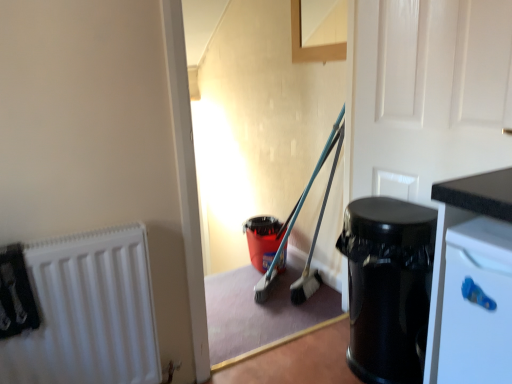
Locate an element on the screen. Image resolution: width=512 pixels, height=384 pixels. white matte radiator at left is located at coordinates (88, 313).

This screenshot has height=384, width=512. What are the coordinates of `black glossy trash can at right` in the screenshot? It's located at (388, 287).

Considering the relative sizes of white glossy door at upper right and white matte radiator at left in the image provided, is white glossy door at upper right thinner than white matte radiator at left?

Indeed, white glossy door at upper right has a lesser width compared to white matte radiator at left.

Where is `door on the right of white matte radiator at left`? door on the right of white matte radiator at left is located at coordinates (426, 93).

Which object is further away from the camera taking this photo, white glossy door at upper right or white matte radiator at left?

white matte radiator at left is more distant.

Is white matte radiator at left taller than black glossy trash can at right?

Incorrect, the height of white matte radiator at left is not larger of that of black glossy trash can at right.

Looking at this image, what's the angular difference between white matte radiator at left and black glossy trash can at right's facing directions?

There is a 87.1-degree angle between the facing directions of white matte radiator at left and black glossy trash can at right.

Does white matte radiator at left have a greater width compared to black glossy trash can at right?

In fact, white matte radiator at left might be narrower than black glossy trash can at right.

Considering the positions of objects white matte radiator at left and black glossy trash can at right in the image provided, who is behind, white matte radiator at left or black glossy trash can at right?

black glossy trash can at right is behind.

Which of these two, white matte radiator at left or white glossy door at upper right, is wider?

white matte radiator at left is wider.

The height and width of the screenshot is (384, 512). Identify the location of door on the right of white matte radiator at left. point(426,93).

From the image's perspective, which object appears higher, white matte radiator at left or white glossy door at upper right?

From the image's view, white glossy door at upper right is above.

How different are the orientations of black glossy trash can at right and white matte radiator at left in degrees?

87.1 degrees separate the facing orientations of black glossy trash can at right and white matte radiator at left.

Considering the sizes of objects black glossy trash can at right and white matte radiator at left in the image provided, who is thinner, black glossy trash can at right or white matte radiator at left?

white matte radiator at left.

How much distance is there between black glossy trash can at right and white matte radiator at left?

34.66 inches.

From the picture: Can you confirm if black glossy trash can at right is smaller than white matte radiator at left?

No.

Can you tell me how much white glossy door at upper right and black glossy trash can at right differ in facing direction?

The angular difference between white glossy door at upper right and black glossy trash can at right is 0.000616 degrees.

Does white glossy door at upper right turn towards black glossy trash can at right?

Yes, white glossy door at upper right is oriented towards black glossy trash can at right.

Which of these two, white glossy door at upper right or black glossy trash can at right, stands shorter?

black glossy trash can at right is shorter.

Measure the distance between white glossy door at upper right and black glossy trash can at right.

15.06 inches.

Is the surface of black glossy trash can at right in direct contact with white glossy door at upper right?

No, black glossy trash can at right is not in contact with white glossy door at upper right.

Is black glossy trash can at right further to the viewer compared to white glossy door at upper right?

Yes, black glossy trash can at right is further from the camera.

Could you tell me if black glossy trash can at right is facing white glossy door at upper right?

No, black glossy trash can at right is not facing towards white glossy door at upper right.

This screenshot has width=512, height=384. Find the location of `radiator below the white glossy door at upper right (from a real-world perspective)`. radiator below the white glossy door at upper right (from a real-world perspective) is located at coordinates [x=88, y=313].

Identify the location of garbage located behind the white matte radiator at left. (388, 287).

Based on their spatial positions, is white matte radiator at left or white glossy door at upper right further from black glossy trash can at right?

The object further to black glossy trash can at right is white matte radiator at left.

From the image, which object appears to be nearer to white glossy door at upper right, white matte radiator at left or black glossy trash can at right?

Among the two, black glossy trash can at right is located nearer to white glossy door at upper right.

Looking at the image, which one is located further to white glossy door at upper right, black glossy trash can at right or white matte radiator at left?

white matte radiator at left is further to white glossy door at upper right.

Based on their spatial positions, is white glossy door at upper right or black glossy trash can at right closer to white matte radiator at left?

The object closer to white matte radiator at left is black glossy trash can at right.

Which object lies nearer to the anchor point white matte radiator at left, black glossy trash can at right or white glossy door at upper right?

Among the two, black glossy trash can at right is located nearer to white matte radiator at left.

Looking at the image, which one is located further to black glossy trash can at right, white glossy door at upper right or white matte radiator at left?

Answer: white matte radiator at left.

This screenshot has height=384, width=512. In order to click on garbage situated between white matte radiator at left and white glossy door at upper right from left to right in this screenshot , I will do `click(388, 287)`.